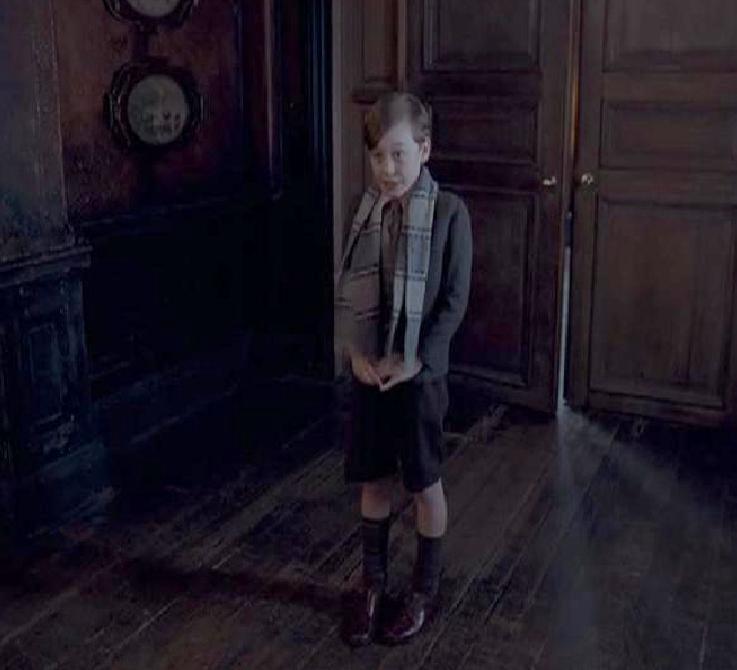
What are the coordinates of `door that's open` in the screenshot? It's located at (548, 182).